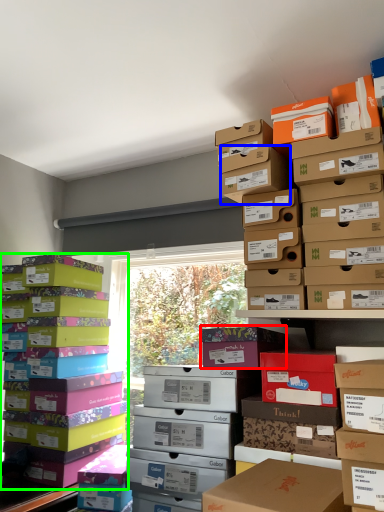
Question: Which is nearer to the cardboard box (highlighted by a red box)? storage box (highlighted by a blue box) or box (highlighted by a green box).

Choices:
 (A) storage box
 (B) box

Answer: (A)